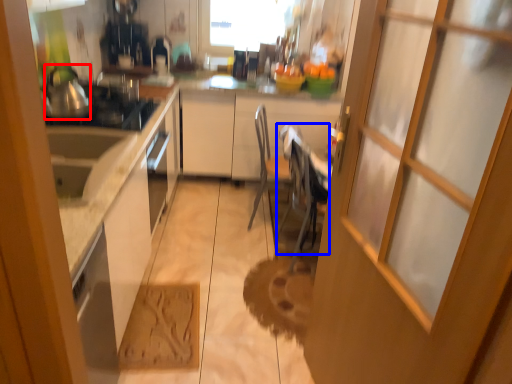
Question: Which of the following is the farthest to the observer, tea pot (highlighted by a red box) or chair (highlighted by a blue box)?

Choices:
 (A) tea pot
 (B) chair

Answer: (B)